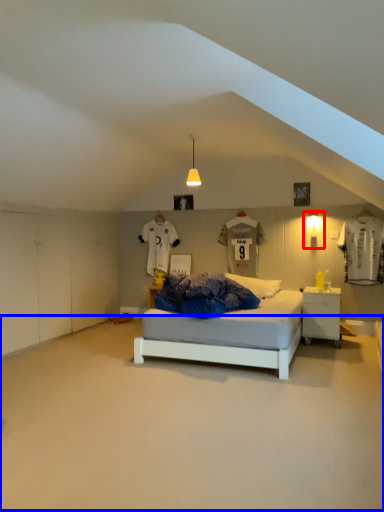
Question: Which object is further to the camera taking this photo, light fixture (highlighted by a red box) or plain (highlighted by a blue box)?

Choices:
 (A) light fixture
 (B) plain

Answer: (A)